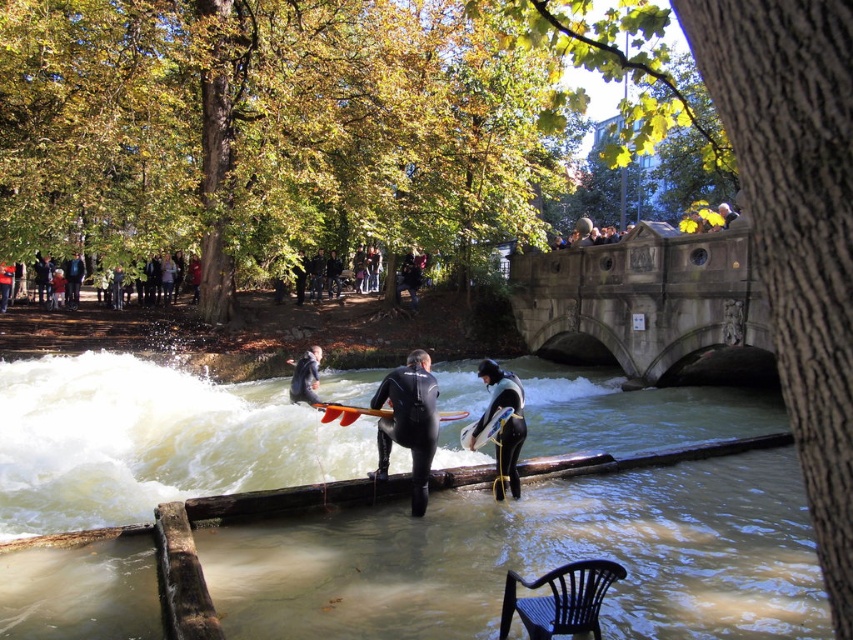
You are standing on the wooden platform by the river and want to cross to the other side. The stone bridge at center is your only option. Can you reach the bridge from the platform without getting wet?

The stone bridge at center is located at point (648, 305), which means it is positioned in a way that you can walk from the wooden platform to the bridge without entering the water, so yes, you can reach it without getting wet.